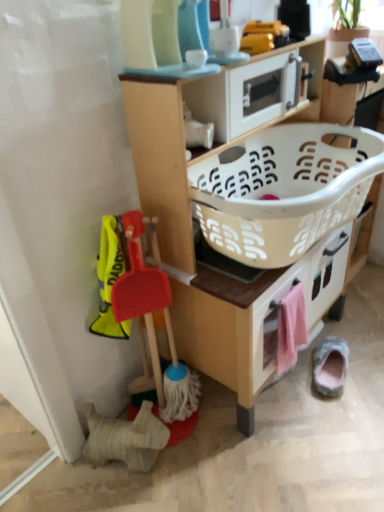
Question: Does white plastic basket at center contain pink fabric drawer at lower right?

Choices:
 (A) yes
 (B) no

Answer: (B)

Question: Does white plastic basket at center have a larger size compared to pink fabric drawer at lower right?

Choices:
 (A) yes
 (B) no

Answer: (A)

Question: Considering the relative sizes of white plastic basket at center and pink fabric drawer at lower right in the image provided, is white plastic basket at center taller than pink fabric drawer at lower right?

Choices:
 (A) no
 (B) yes

Answer: (A)

Question: Does white plastic basket at center have a lesser width compared to pink fabric drawer at lower right?

Choices:
 (A) yes
 (B) no

Answer: (B)

Question: Is white plastic basket at center not within pink fabric drawer at lower right?

Choices:
 (A) no
 (B) yes

Answer: (B)

Question: Is white plastic basket at center positioned behind pink fabric drawer at lower right?

Choices:
 (A) yes
 (B) no

Answer: (B)

Question: Is white plastic microwave at upper center closer to the viewer compared to white plastic basket at center?

Choices:
 (A) yes
 (B) no

Answer: (B)

Question: Is white plastic microwave at upper center looking in the opposite direction of white plastic basket at center?

Choices:
 (A) no
 (B) yes

Answer: (A)

Question: Considering the relative sizes of white plastic microwave at upper center and white plastic basket at center in the image provided, is white plastic microwave at upper center bigger than white plastic basket at center?

Choices:
 (A) yes
 (B) no

Answer: (B)

Question: Can you confirm if white plastic microwave at upper center is positioned to the left of white plastic basket at center?

Choices:
 (A) yes
 (B) no

Answer: (A)

Question: Is white plastic microwave at upper center smaller than white plastic basket at center?

Choices:
 (A) no
 (B) yes

Answer: (B)

Question: Is white plastic microwave at upper center further to camera compared to white plastic basket at center?

Choices:
 (A) yes
 (B) no

Answer: (A)

Question: Is the depth of white plastic basket at center less than that of gray suede slipper at lower right?

Choices:
 (A) yes
 (B) no

Answer: (A)